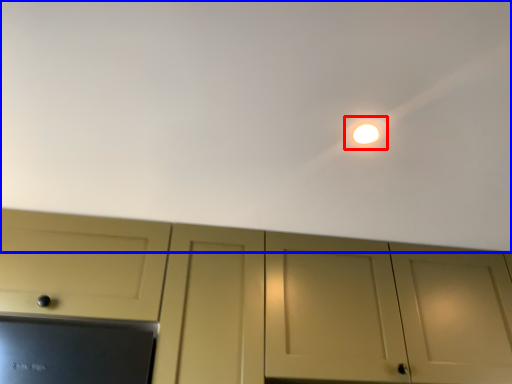
Question: Which of the following is the closest to the observer, light (highlighted by a red box) or backdrop (highlighted by a blue box)?

Choices:
 (A) light
 (B) backdrop

Answer: (B)